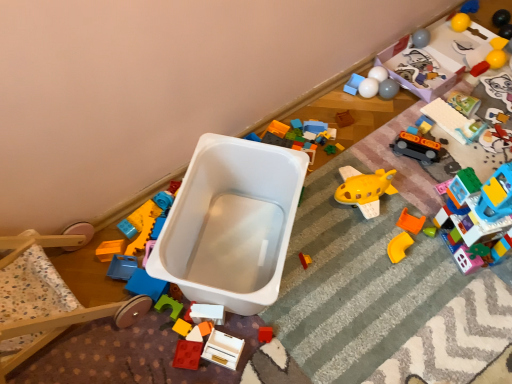
Find the location of a particular element. This screenshot has height=384, width=512. free space between matte gray cat at upper right, which is the fifteenth toy in left-to-right order, and wooden toy box at center, arranged as the fourth toy when viewed from the left is located at coordinates (384, 210).